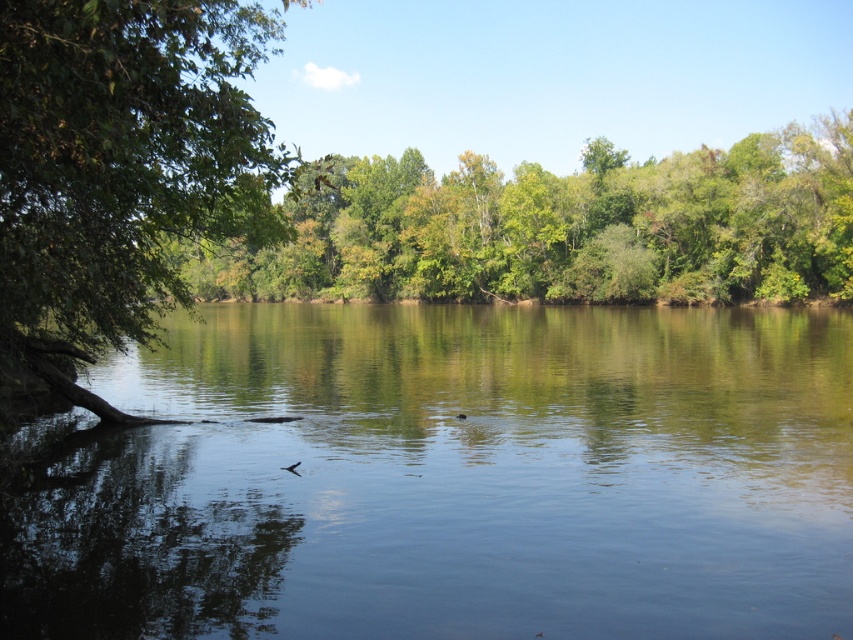
Looking at this image, does clear water at center have a greater height compared to green leafy trees at center?

No.

Is clear water at center to the right of green leafy trees at center from the viewer's perspective?

Correct, you'll find clear water at center to the right of green leafy trees at center.

Is point (76, 524) more distant than point (502, 285)?

No, (76, 524) is closer to viewer.

Where is `clear water at center`? clear water at center is located at coordinates (456, 477).

Can you confirm if clear water at center is wider than green leafy tree at left?

Yes, clear water at center is wider than green leafy tree at left.

Is clear water at center above green leafy tree at left?

No, clear water at center is not above green leafy tree at left.

Locate an element on the screen. The width and height of the screenshot is (853, 640). clear water at center is located at coordinates (456, 477).

The width and height of the screenshot is (853, 640). Identify the location of clear water at center. (456, 477).

Does point (605, 275) lie behind point (202, 29)?

Yes, point (605, 275) is farther from viewer.

Identify the location of green leafy trees at center. (560, 228).